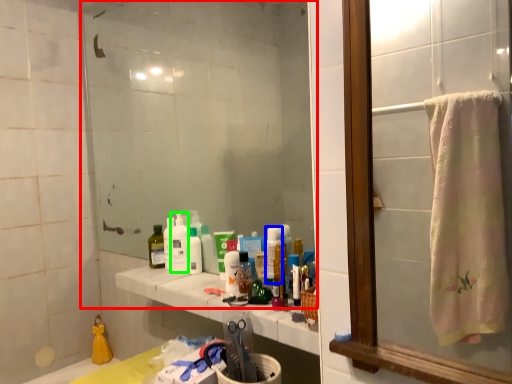
Question: Which object is positioned farthest from mirror (highlighted by a red box)? Select from cleaning product (highlighted by a blue box) and cleaning product (highlighted by a green box).

Choices:
 (A) cleaning product
 (B) cleaning product

Answer: (A)